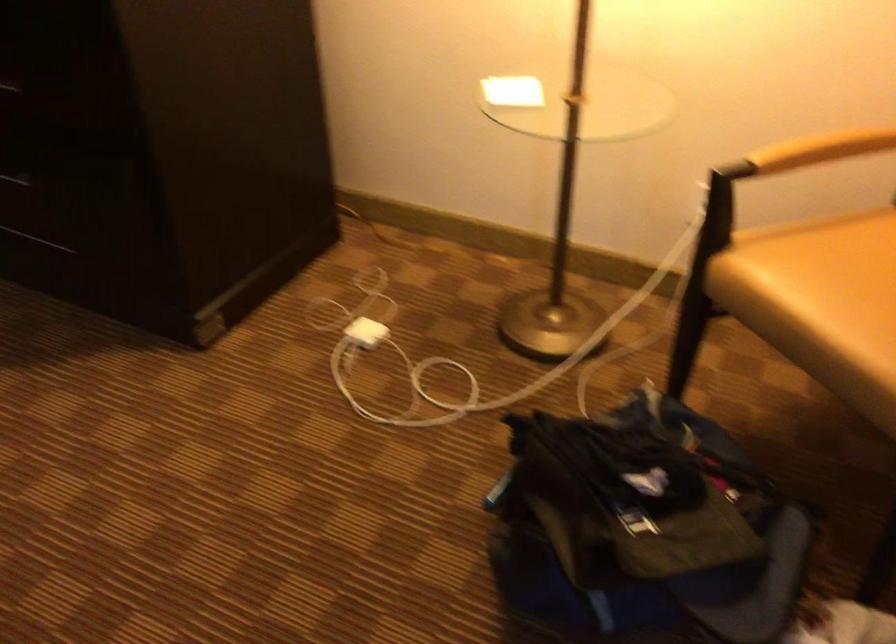
Find where to lift the white paper card. Please return your answer as a coordinate pair (x, y).

(513, 91)